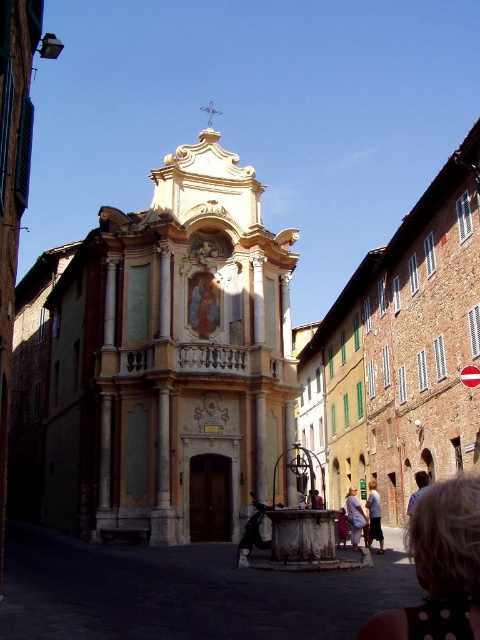
Question: Which of the following is the closest to the observer?

Choices:
 (A) light brown leather shoe at center
 (B) light yellow stone church at center
 (C) light brown hair at center

Answer: (A)

Question: Is blonde hair at lower right thinner than light brown hair at center?

Choices:
 (A) yes
 (B) no

Answer: (A)

Question: Where is light yellow stone church at center located in relation to blonde hair at lower right in the image?

Choices:
 (A) right
 (B) left

Answer: (B)

Question: Which object is positioned farthest from the light brown leather shoe at center?

Choices:
 (A) white cotton shirt at center
 (B) light yellow stone church at center

Answer: (B)

Question: Can you confirm if light yellow stone church at center is smaller than light brown hair at center?

Choices:
 (A) yes
 (B) no

Answer: (B)

Question: Which of these objects is positioned closest to the blonde hair at lower right?

Choices:
 (A) light brown hair at center
 (B) light brown leather shoe at center

Answer: (B)